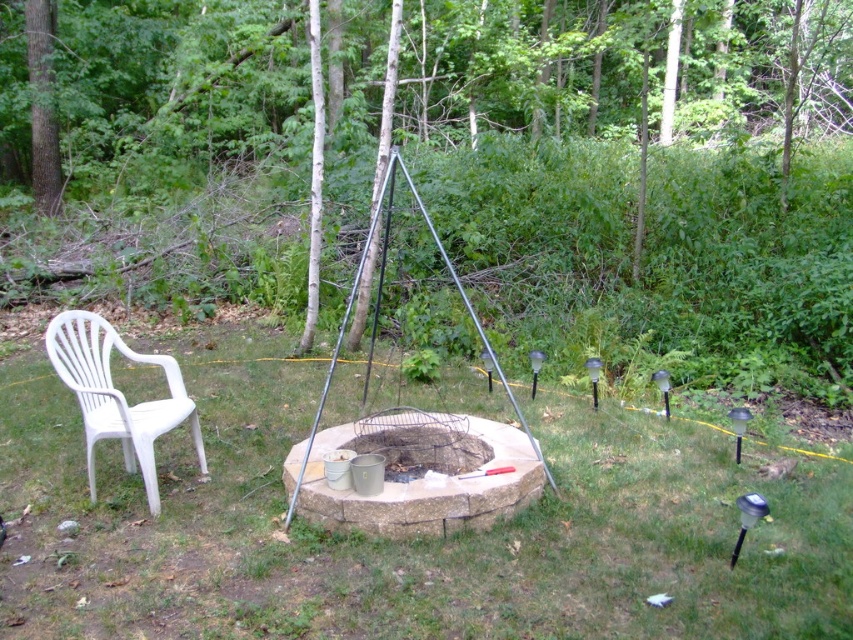
Question: Can you confirm if brown wood tree at center is positioned to the left of white plastic chair at left?

Choices:
 (A) no
 (B) yes

Answer: (A)

Question: Can you confirm if brown wood tree at center is positioned below white plastic chair at left?

Choices:
 (A) yes
 (B) no

Answer: (B)

Question: Which of the following is the farthest from the observer?

Choices:
 (A) (213, 36)
 (B) (53, 323)

Answer: (A)

Question: Among these points, which one is farthest from the camera?

Choices:
 (A) click(67, 317)
 (B) click(122, 42)

Answer: (B)

Question: Is brown wood tree at center below white plastic chair at left?

Choices:
 (A) yes
 (B) no

Answer: (B)